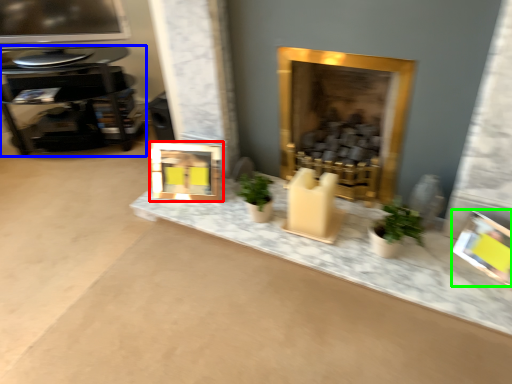
Question: Which is farther away from picture frame (highlighted by a red box)? table (highlighted by a blue box) or picture frame (highlighted by a green box)?

Choices:
 (A) table
 (B) picture frame

Answer: (B)